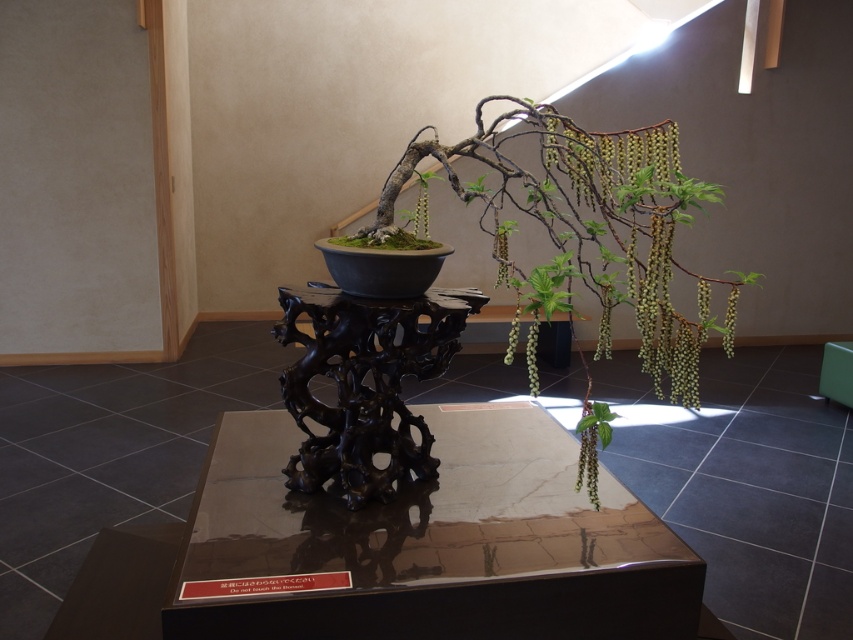
Is glossy dark wood table at center positioned at the back of green matte plant at center?

No, glossy dark wood table at center is in front of green matte plant at center.

Which is above, glossy dark wood table at center or green matte plant at center?

green matte plant at center

Is point (612, 598) positioned behind point (436, 176)?

No.

The image size is (853, 640). What are the coordinates of `glossy dark wood table at center` in the screenshot? It's located at (428, 544).

Does green matte bonsai tree at center come behind green matte plant at center?

That is False.

Can you confirm if green matte bonsai tree at center is thinner than green matte plant at center?

No, green matte bonsai tree at center is not thinner than green matte plant at center.

Find the location of a particular element. This screenshot has width=853, height=640. green matte bonsai tree at center is located at coordinates (585, 227).

Image resolution: width=853 pixels, height=640 pixels. Find the location of `green matte bonsai tree at center`. green matte bonsai tree at center is located at coordinates (585, 227).

This screenshot has height=640, width=853. What do you see at coordinates (428, 544) in the screenshot? I see `glossy dark wood table at center` at bounding box center [428, 544].

Between glossy dark wood table at center and green matte bonsai tree at center, which one is positioned higher?

green matte bonsai tree at center

Is point (440, 481) positioned before point (614, 173)?

No.

The height and width of the screenshot is (640, 853). I want to click on glossy dark wood table at center, so click(428, 544).